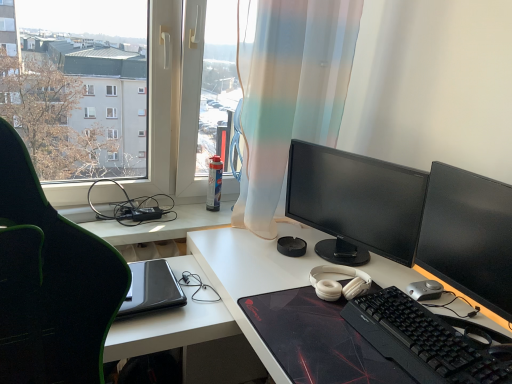
Locate an element on the screen. This screenshot has height=384, width=512. vacant space situated above black matte desk at center (from a real-world perspective) is located at coordinates (308, 288).